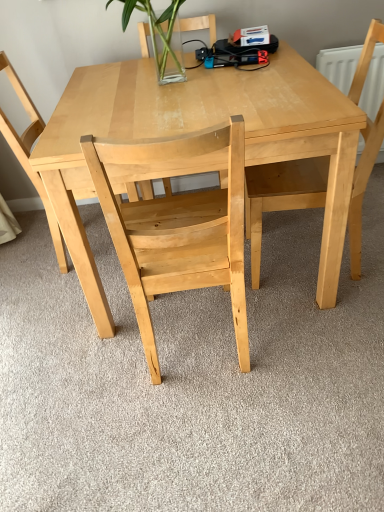
This screenshot has width=384, height=512. In order to click on free space underneath natural wood chair at center, the 2th chair viewed from the left (from a real-world perspective) in this screenshot , I will do `click(200, 353)`.